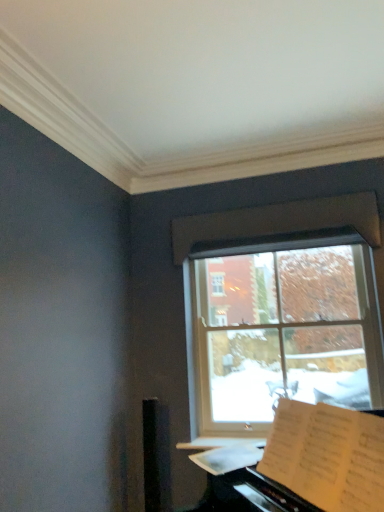
Question: From a real-world perspective, is clear glass window at center over white paper sheet music at lower right?

Choices:
 (A) yes
 (B) no

Answer: (A)

Question: From the image's perspective, would you say clear glass window at center is shown under white paper sheet music at lower right?

Choices:
 (A) yes
 (B) no

Answer: (B)

Question: Can you confirm if clear glass window at center is positioned to the left of white paper sheet music at lower right?

Choices:
 (A) no
 (B) yes

Answer: (A)

Question: Considering the relative sizes of clear glass window at center and white paper sheet music at lower right in the image provided, is clear glass window at center smaller than white paper sheet music at lower right?

Choices:
 (A) no
 (B) yes

Answer: (A)

Question: Does clear glass window at center have a lesser height compared to white paper sheet music at lower right?

Choices:
 (A) yes
 (B) no

Answer: (B)

Question: Considering their positions, is white paper sheet music at lower right located in front of or behind white paper at lower right?

Choices:
 (A) behind
 (B) front

Answer: (A)

Question: Is white paper sheet music at lower right bigger or smaller than white paper at lower right?

Choices:
 (A) small
 (B) big

Answer: (A)

Question: Would you say white paper sheet music at lower right is inside or outside white paper at lower right?

Choices:
 (A) outside
 (B) inside

Answer: (B)

Question: Considering the relative positions of white paper sheet music at lower right and white paper at lower right in the image provided, is white paper sheet music at lower right to the left or to the right of white paper at lower right?

Choices:
 (A) right
 (B) left

Answer: (B)

Question: From the image's perspective, is clear glass window at center positioned above or below white paper sheet music at lower right?

Choices:
 (A) below
 (B) above

Answer: (B)

Question: Looking at the image, does clear glass window at center seem bigger or smaller compared to white paper sheet music at lower right?

Choices:
 (A) big
 (B) small

Answer: (A)

Question: Choose the correct answer: Is clear glass window at center inside white paper sheet music at lower right or outside it?

Choices:
 (A) outside
 (B) inside

Answer: (A)

Question: From a real-world perspective, is clear glass window at center positioned above or below white paper sheet music at lower right?

Choices:
 (A) below
 (B) above

Answer: (B)

Question: Which is correct: white paper at lower right is inside white paper sheet music at lower right, or outside of it?

Choices:
 (A) inside
 (B) outside

Answer: (B)

Question: Considering their positions, is white paper at lower right located in front of or behind white paper sheet music at lower right?

Choices:
 (A) behind
 (B) front

Answer: (B)